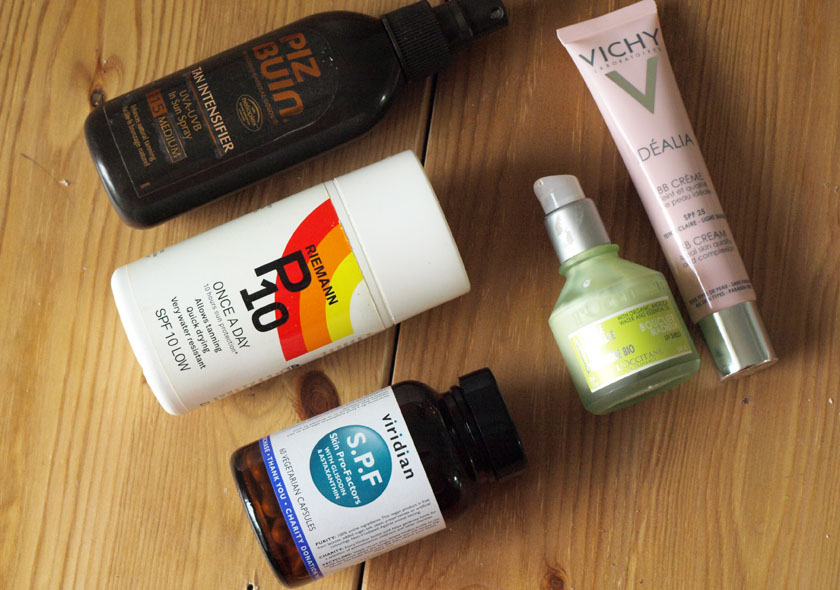
Where is `2 wooden planks for the background`? The image size is (840, 590). 2 wooden planks for the background is located at coordinates (633, 465), (91, 418).